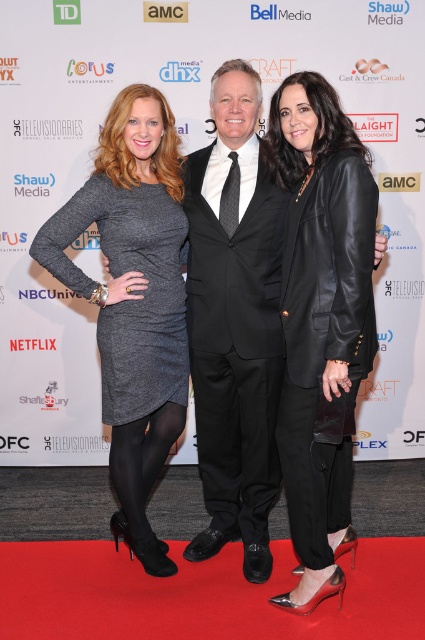
Does black leather blazer at center appear on the right side of black satin suit at center?

Indeed, black leather blazer at center is positioned on the right side of black satin suit at center.

Which is below, black leather blazer at center or black satin suit at center?

black leather blazer at center is below.

Measure the distance between point [306,227] and camera.

Point [306,227] and camera are 1.95 meters apart from each other.

Find the location of `black leather blazer at center`. black leather blazer at center is located at coordinates (322, 323).

Does point (223, 262) come farther from viewer compared to point (142, 298)?

Yes.

Which is below, black satin suit at center or gray knit dress at left?

gray knit dress at left is lower down.

Who is more forward, [210,108] or [141,465]?

Point [210,108]

You are a GUI agent. You are given a task and a screenshot of the screen. Output one action in this format:
    pyautogui.click(x=<x>, y=<y>)
    Task: Click on the black satin suit at center
    The height and width of the screenshot is (640, 425).
    Given the screenshot: What is the action you would take?
    pyautogui.click(x=235, y=321)

Is black leather blazer at center wider than gray knit dress at left?

No.

Can you confirm if black leather blazer at center is positioned to the right of gray knit dress at left?

Yes, black leather blazer at center is to the right of gray knit dress at left.

Does point (302, 408) come behind point (112, 384)?

No, (302, 408) is in front of (112, 384).

Locate an element on the screen. The image size is (425, 640). black leather blazer at center is located at coordinates (322, 323).